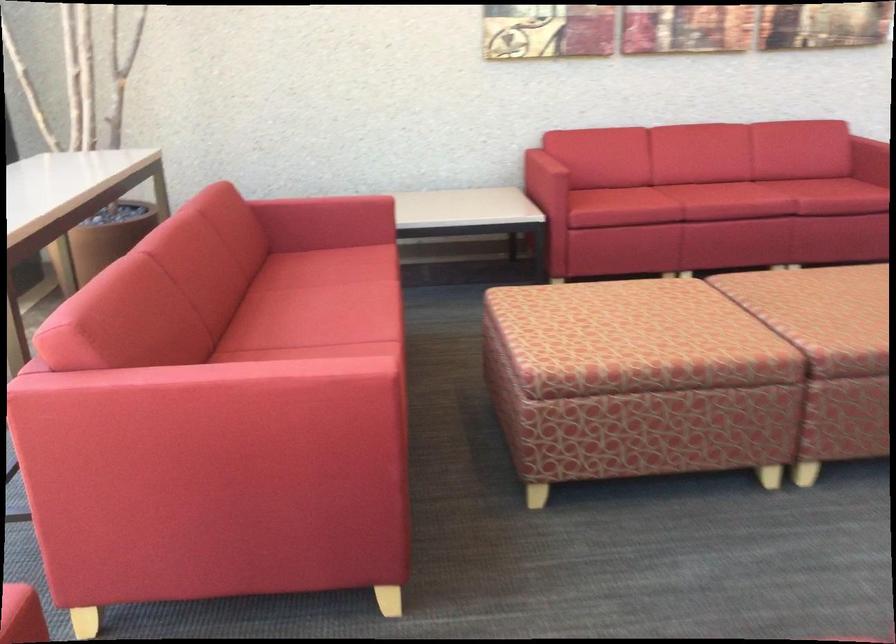
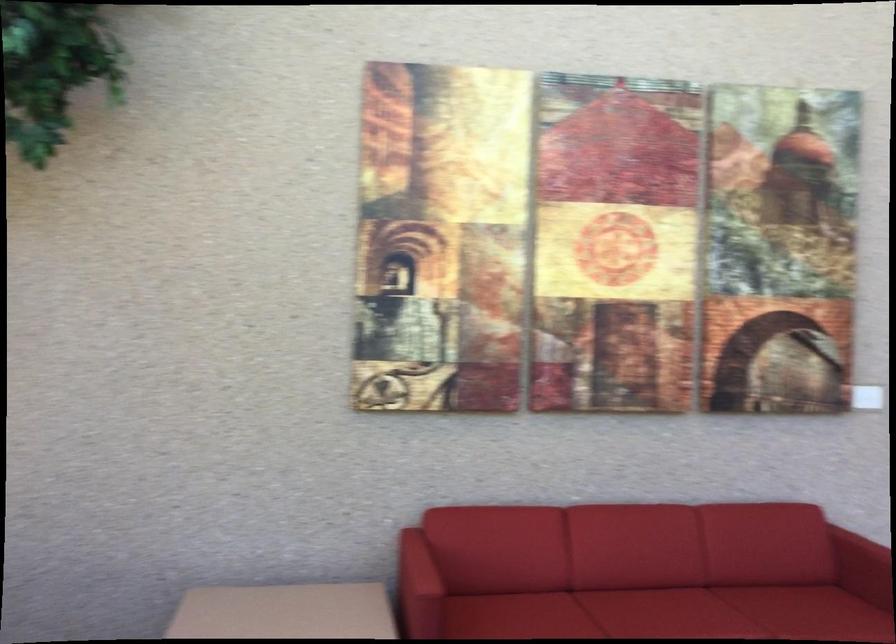
Where in the second image is the point corresponding to pixel 543 154 from the first image?

(418, 564)